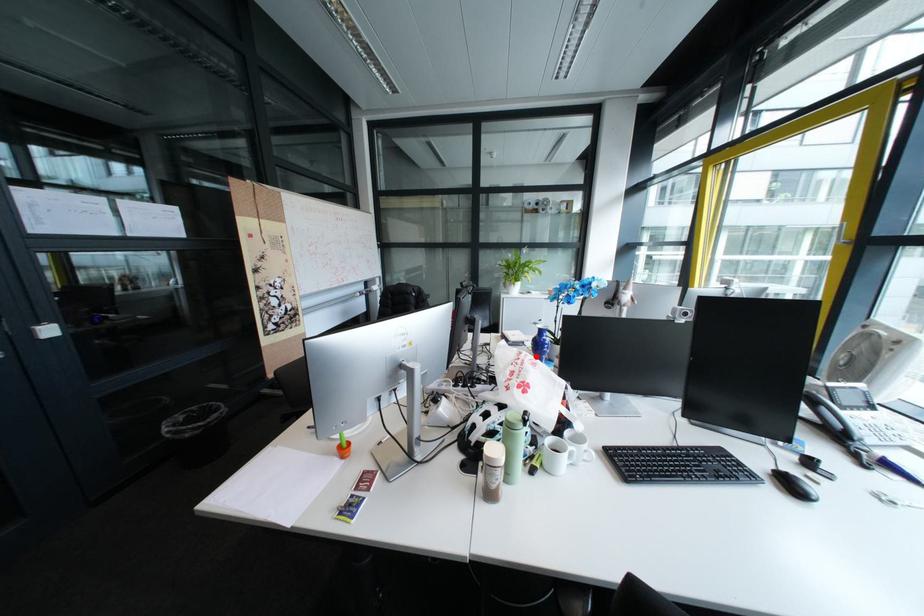
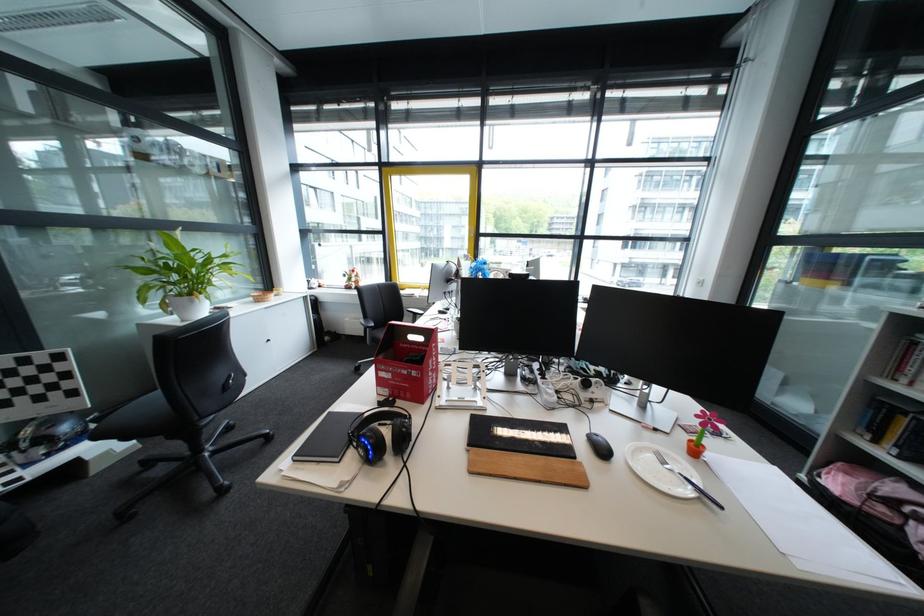
Question: I am providing you with two images of the same scene from different viewpoints. A red point is marked on the first image. Is the red point's position out of view in image 2?

Choices:
 (A) Yes
 (B) No

Answer: (A)